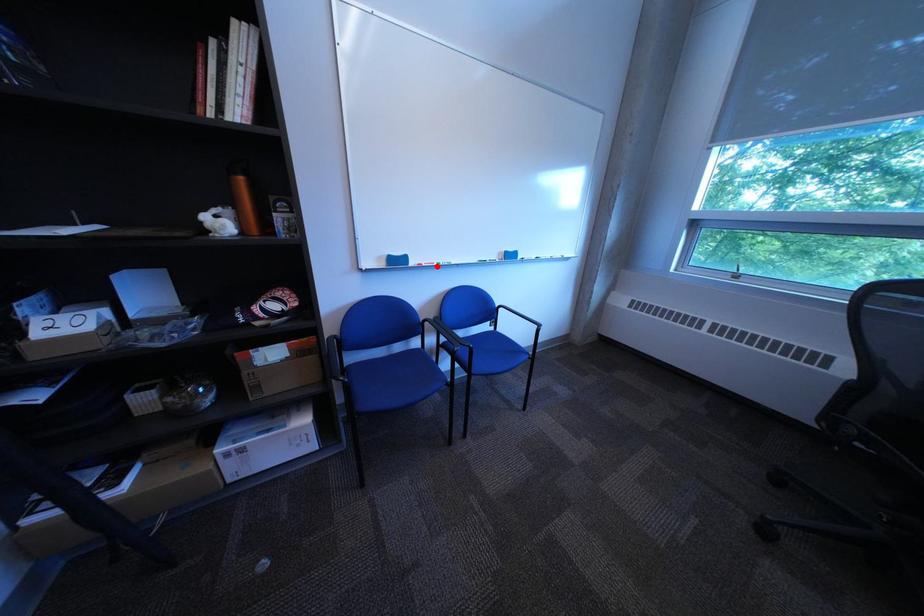
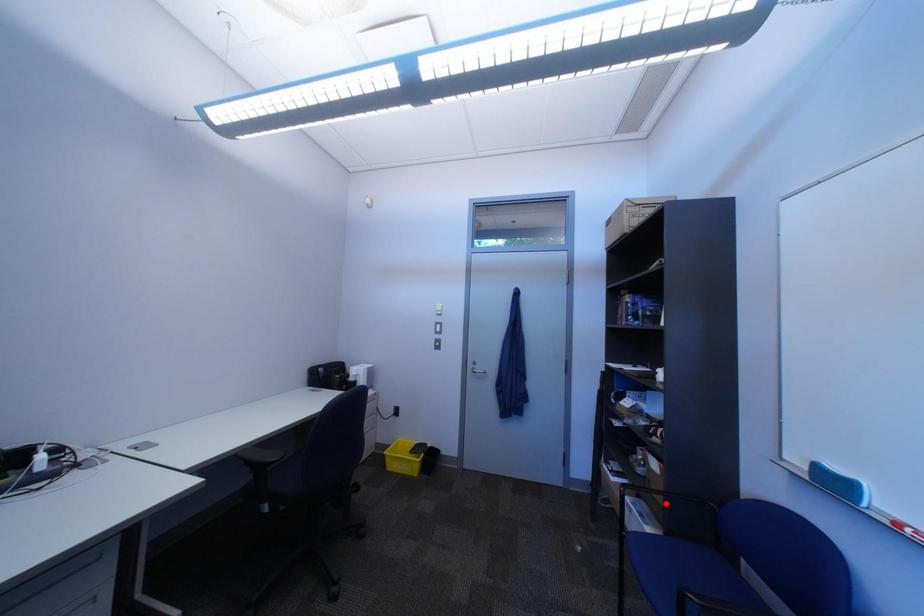
I am providing you with two images of the same scene from different viewpoints. A red point is marked on the first image and another point is marked on the second image. Do the highlighted points in image1 and image2 indicate the same real-world spot?

No